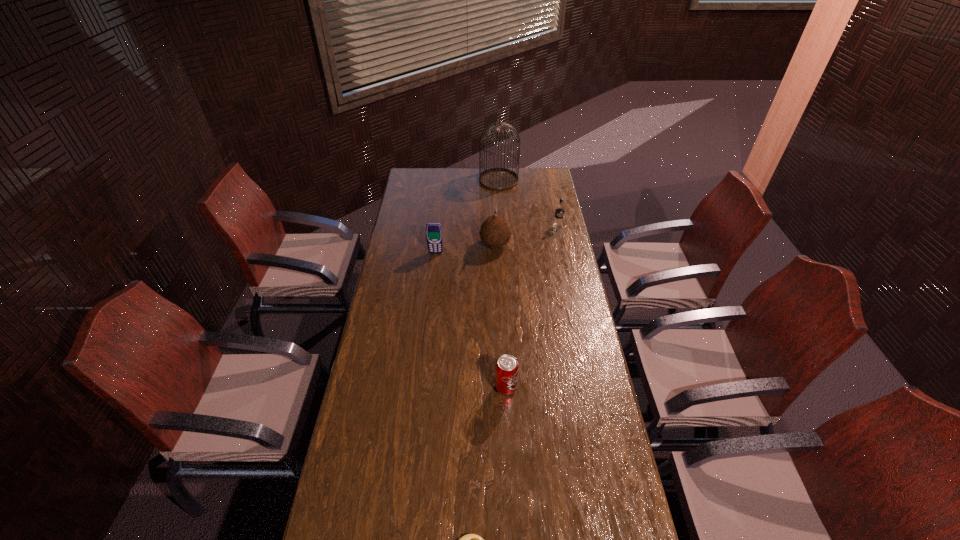
Image resolution: width=960 pixels, height=540 pixels. In order to click on free space between the cellular telephone and the coconut in this screenshot , I will do `click(466, 249)`.

The width and height of the screenshot is (960, 540). What are the coordinates of `empty space between the cellular telephone and the fifth shortest object` in the screenshot? It's located at (466, 249).

Image resolution: width=960 pixels, height=540 pixels. I want to click on free space that is in between the farthest object and the leftmost object, so click(468, 217).

This screenshot has height=540, width=960. What are the coordinates of `free space between the second nearest object and the vodka` in the screenshot? It's located at (532, 307).

Locate an element on the screen. Image resolution: width=960 pixels, height=540 pixels. blank region between the farthest object and the vodka is located at coordinates (528, 203).

I want to click on free area in between the farthest object and the fifth nearest object, so click(528, 203).

You are a GUI agent. You are given a task and a screenshot of the screen. Output one action in this format:
    pyautogui.click(x=<x>, y=<y>)
    Task: Click on the second closest object relative to the leftmost object
    
    Given the screenshot: What is the action you would take?
    pyautogui.click(x=498, y=179)

Select which object appears as the third closest to the coconut. Please provide its 2D coordinates. Your answer should be formatted as a tuple, i.e. [(x, y)], where the tuple contains the x and y coordinates of a point satisfying the conditions above.

[(498, 179)]

Locate an element on the screen. This screenshot has width=960, height=540. vacant space that satisfies the following two spatial constraints: 1. on the front-facing side of the soda; 2. on the right side of the cellular telephone is located at coordinates (420, 388).

Find the location of `vacant region that satisfies the following two spatial constraints: 1. on the label of the second farthest object; 2. on the surface of the second tallest object`. vacant region that satisfies the following two spatial constraints: 1. on the label of the second farthest object; 2. on the surface of the second tallest object is located at coordinates (562, 245).